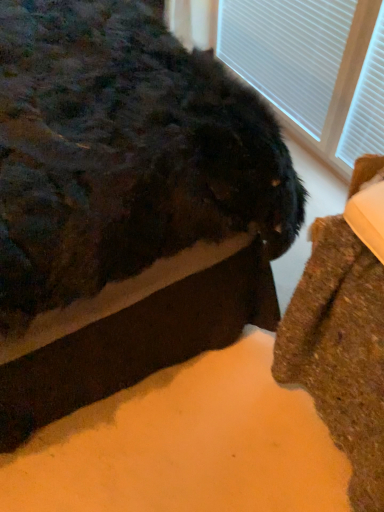
At what (x,y) coordinates should I click in order to perform the action: click on fuzzy black cat at lower right. Please return your answer as a coordinate pair (x, y). Looking at the image, I should click on (123, 153).

The image size is (384, 512). What do you see at coordinates (340, 351) in the screenshot?
I see `brown textured rug at lower right` at bounding box center [340, 351].

This screenshot has width=384, height=512. Identify the location of white textured blinds at upper right. (310, 67).

How distant is brown textured rug at lower right from fuzzy black cat at lower right?

They are 15.79 inches apart.

Is brown textured rug at lower right far away from fuzzy black cat at lower right?

They are positioned close to each other.

Between brown textured rug at lower right and fuzzy black cat at lower right, which one has smaller size?

brown textured rug at lower right.

From a real-world perspective, who is located lower, brown textured rug at lower right or fuzzy black cat at lower right?

brown textured rug at lower right is physically lower.

Is brown textured rug at lower right shorter than white textured blinds at upper right?

No, brown textured rug at lower right is not shorter than white textured blinds at upper right.

From the image's perspective, is brown textured rug at lower right on white textured blinds at upper right?

No, from the image's perspective, brown textured rug at lower right is not above white textured blinds at upper right.

Consider the image. From a real-world perspective, is brown textured rug at lower right positioned under white textured blinds at upper right based on gravity?

Yes.

Looking at this image, is white textured blinds at upper right outside of brown textured rug at lower right?

Yes, white textured blinds at upper right is outside of brown textured rug at lower right.

Between white textured blinds at upper right and brown textured rug at lower right, which one appears on the right side from the viewer's perspective?

From the viewer's perspective, brown textured rug at lower right appears more on the right side.

Locate an element on the screen. Image resolution: width=384 pixels, height=512 pixels. furniture on the right of white textured blinds at upper right is located at coordinates (340, 351).

Which of these two, white textured blinds at upper right or brown textured rug at lower right, is bigger?

brown textured rug at lower right is bigger.

From the image's perspective, relative to white textured blinds at upper right, is fuzzy black cat at lower right above or below?

Clearly, from the image's perspective, fuzzy black cat at lower right is below white textured blinds at upper right.

Is fuzzy black cat at lower right facing away from white textured blinds at upper right?

That's not correct — fuzzy black cat at lower right is not looking away from white textured blinds at upper right.

From a real-world perspective, who is located higher, fuzzy black cat at lower right or white textured blinds at upper right?

In real-world perspective, fuzzy black cat at lower right is above.

From the image's perspective, does fuzzy black cat at lower right appear lower than brown textured rug at lower right?

No, from the image's perspective, fuzzy black cat at lower right is not beneath brown textured rug at lower right.

Between fuzzy black cat at lower right and brown textured rug at lower right, which one has more height?

With more height is fuzzy black cat at lower right.

How many degrees apart are the facing directions of fuzzy black cat at lower right and brown textured rug at lower right?

They differ by 92.3 degrees in their facing directions.

Measure the distance between fuzzy black cat at lower right and brown textured rug at lower right.

The distance of fuzzy black cat at lower right from brown textured rug at lower right is 15.79 inches.

Considering the sizes of objects white textured blinds at upper right and fuzzy black cat at lower right in the image provided, who is smaller, white textured blinds at upper right or fuzzy black cat at lower right?

With smaller size is white textured blinds at upper right.

The height and width of the screenshot is (512, 384). Identify the location of animal that is below the white textured blinds at upper right (from the image's perspective). (123, 153).

Considering the points (338, 129) and (102, 91), which point is in front, point (338, 129) or point (102, 91)?

The point (102, 91) is in front.

From a real-world perspective, does white textured blinds at upper right stand above fuzzy black cat at lower right?

No.

Image resolution: width=384 pixels, height=512 pixels. I want to click on furniture lying on the right of fuzzy black cat at lower right, so click(340, 351).

The image size is (384, 512). I want to click on furniture in front of the white textured blinds at upper right, so click(340, 351).

Which object lies further to the anchor point fuzzy black cat at lower right, white textured blinds at upper right or brown textured rug at lower right?

Based on the image, white textured blinds at upper right appears to be further to fuzzy black cat at lower right.

From the image, which object appears to be farther from brown textured rug at lower right, white textured blinds at upper right or fuzzy black cat at lower right?

white textured blinds at upper right is positioned further to the anchor brown textured rug at lower right.

From the picture: Estimate the real-world distances between objects in this image. Which object is closer to white textured blinds at upper right, fuzzy black cat at lower right or brown textured rug at lower right?

The object closer to white textured blinds at upper right is fuzzy black cat at lower right.

When comparing their distances from fuzzy black cat at lower right, does brown textured rug at lower right or white textured blinds at upper right seem closer?

The object closer to fuzzy black cat at lower right is brown textured rug at lower right.

Consider the image. Which object lies further to the anchor point white textured blinds at upper right, brown textured rug at lower right or fuzzy black cat at lower right?

brown textured rug at lower right is positioned further to the anchor white textured blinds at upper right.

Looking at the image, which one is located closer to brown textured rug at lower right, fuzzy black cat at lower right or white textured blinds at upper right?

fuzzy black cat at lower right.

Where is `furniture between fuzzy black cat at lower right and white textured blinds at upper right in the front-back direction`? The height and width of the screenshot is (512, 384). furniture between fuzzy black cat at lower right and white textured blinds at upper right in the front-back direction is located at coordinates (340, 351).